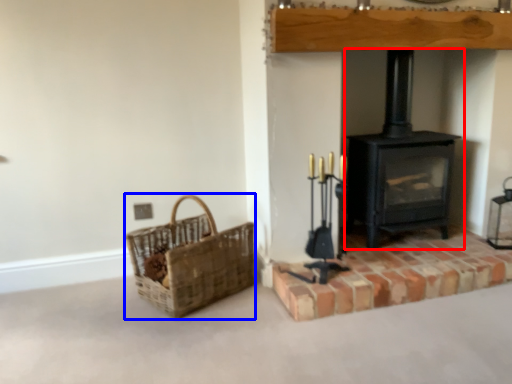
Question: Which object appears closest to the camera in this image, wood burning stove (highlighted by a red box) or basket (highlighted by a blue box)?

Choices:
 (A) wood burning stove
 (B) basket

Answer: (B)